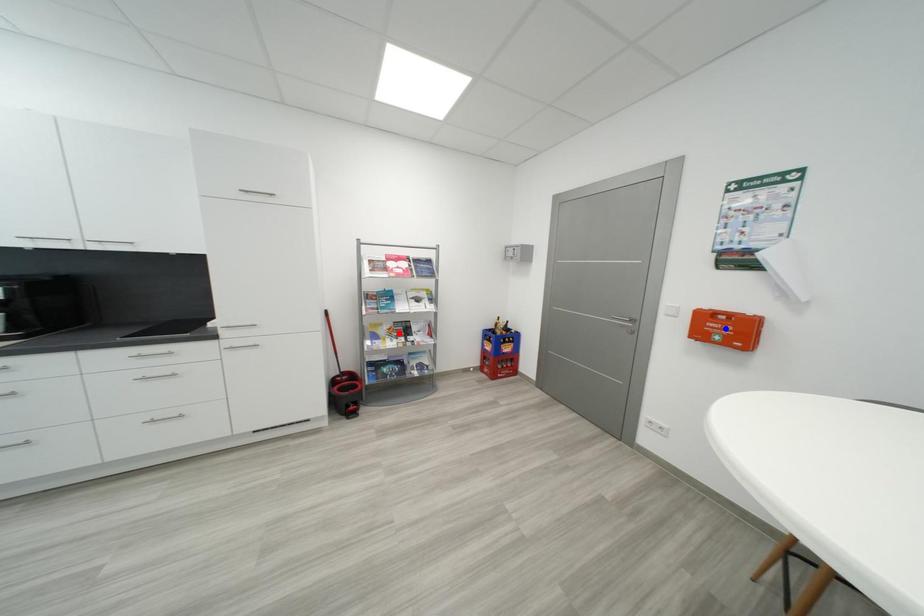
Question: Two points are marked on the image. Which point is closer to the camera?

Choices:
 (A) Blue point is closer.
 (B) Red point is closer.

Answer: (A)